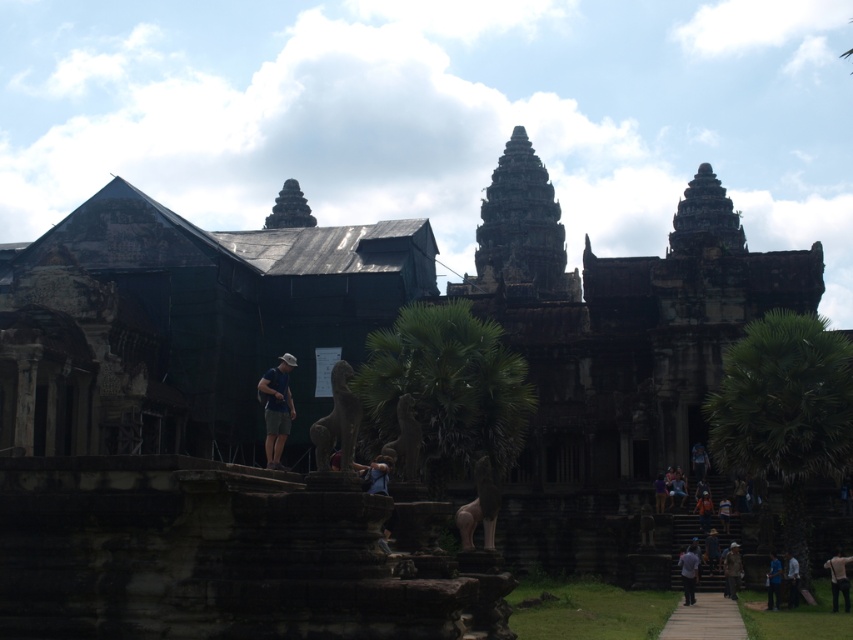
Question: Which of the following is the farthest from the observer?

Choices:
 (A) gray fabric shirt at lower right
 (B) light blue shirt at lower right

Answer: (A)

Question: Which of the following is the closest to the observer?

Choices:
 (A) light blue shirt at lower right
 (B) brown leather jacket at lower right
 (C) blue fabric shirt at lower right

Answer: (A)

Question: Which object appears farthest from the camera in this image?

Choices:
 (A) brown leather jacket at lower right
 (B) light blue shirt at lower right

Answer: (A)

Question: From the image, what is the correct spatial relationship of gray fabric shirt at lower right in relation to blue fabric shirt at lower right?

Choices:
 (A) left
 (B) right

Answer: (A)

Question: Can you confirm if blue fabric shirt at lower right is thinner than light blue shirt at lower right?

Choices:
 (A) no
 (B) yes

Answer: (B)

Question: Is gray fabric shirt at lower right further to camera compared to brown leather jacket at lower right?

Choices:
 (A) no
 (B) yes

Answer: (A)